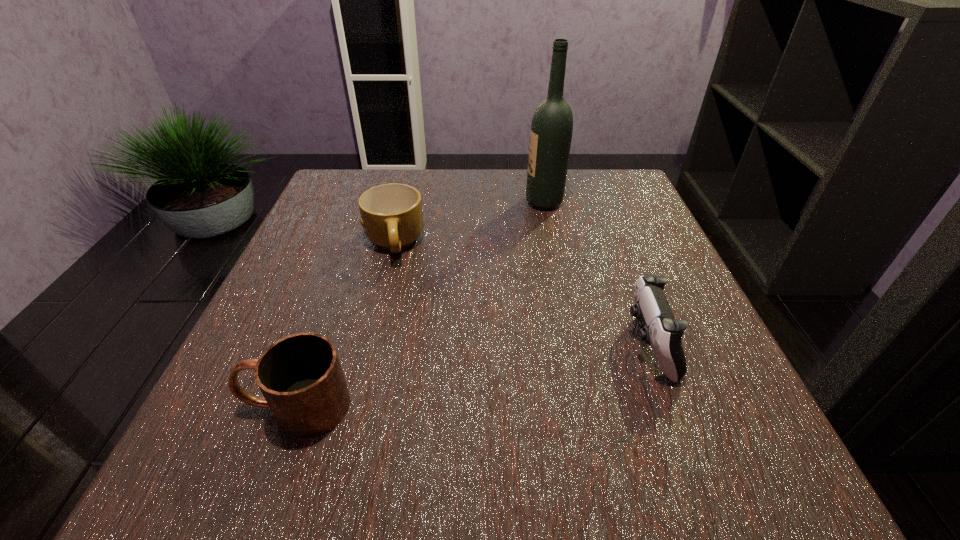
Locate an element on the screen. The height and width of the screenshot is (540, 960). free space that is in between the wine bottle and the farther mug is located at coordinates (469, 222).

Identify the location of object that is the closest to the control. The height and width of the screenshot is (540, 960). (551, 131).

Point out which object is positioned as the nearest to the tallest object. Please provide its 2D coordinates. Your answer should be formatted as a tuple, i.e. [(x, y)], where the tuple contains the x and y coordinates of a point satisfying the conditions above.

[(391, 214)]

The image size is (960, 540). Find the location of `free spot that satisfies the following two spatial constraints: 1. on the labeled side of the farthest object; 2. on the side with the handle of the second farthest object`. free spot that satisfies the following two spatial constraints: 1. on the labeled side of the farthest object; 2. on the side with the handle of the second farthest object is located at coordinates (552, 243).

Find the location of `blank area in the image that satisfies the following two spatial constraints: 1. on the side with the handle of the second farthest object; 2. on the side of the nearer mug with the handle`. blank area in the image that satisfies the following two spatial constraints: 1. on the side with the handle of the second farthest object; 2. on the side of the nearer mug with the handle is located at coordinates (354, 406).

Identify the location of vacant area in the image that satisfies the following two spatial constraints: 1. on the labeled side of the wine bottle; 2. on the side with the handle of the farther mug. The image size is (960, 540). (552, 243).

You are a GUI agent. You are given a task and a screenshot of the screen. Output one action in this format:
    pyautogui.click(x=<x>, y=<y>)
    Task: Click on the free region that satisfies the following two spatial constraints: 1. on the side with the handle of the third nearest object; 2. on the side of the nearer mug with the handle
    This screenshot has width=960, height=540.
    Given the screenshot: What is the action you would take?
    pyautogui.click(x=354, y=406)

Identify the location of free space that satisfies the following two spatial constraints: 1. on the side with the handle of the third nearest object; 2. on the side of the nearer mug with the handle. The width and height of the screenshot is (960, 540). (354, 406).